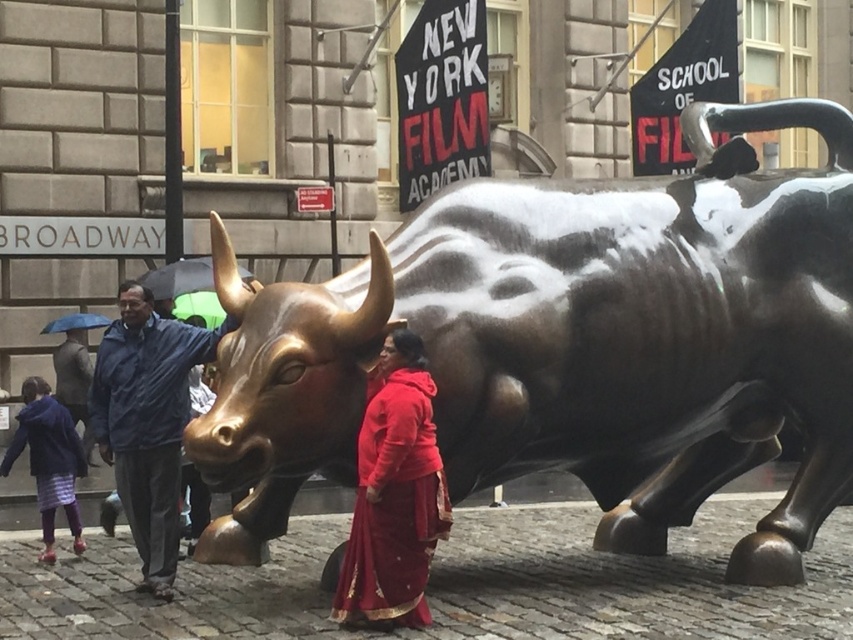
Can you confirm if blue fabric jacket at center is positioned above plaid fabric pants at lower left?

Yes, blue fabric jacket at center is above plaid fabric pants at lower left.

Is blue fabric jacket at center below plaid fabric pants at lower left?

No.

Does point (120, 342) come farther from viewer compared to point (62, 454)?

That is False.

The width and height of the screenshot is (853, 640). What are the coordinates of `blue fabric jacket at center` in the screenshot? It's located at (148, 420).

Between bronze bull at center and plaid fabric pants at lower left, which one is positioned lower?

plaid fabric pants at lower left is lower down.

Is point (299, 406) behind point (49, 483)?

No, it is in front of (49, 483).

Is point (796, 225) in front of point (73, 442)?

Yes, it is.

I want to click on bronze bull at center, so click(x=573, y=344).

Can you confirm if bronze bull at center is thinner than blue fabric jacket at center?

Incorrect, bronze bull at center's width is not less than blue fabric jacket at center's.

Which is behind, point (581, 234) or point (99, 380)?

Point (581, 234)

Where is `bronze bull at center`? bronze bull at center is located at coordinates (573, 344).